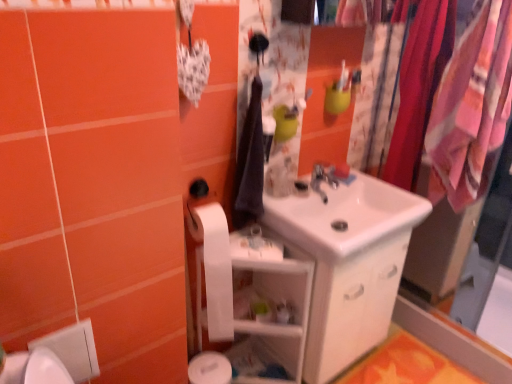
Question: From the image's perspective, is orange fabric bath mat at lower right on top of white glossy sink at center?

Choices:
 (A) no
 (B) yes

Answer: (A)

Question: Considering the relative positions of orange fabric bath mat at lower right and white glossy sink at center in the image provided, is orange fabric bath mat at lower right to the right of white glossy sink at center from the viewer's perspective?

Choices:
 (A) yes
 (B) no

Answer: (A)

Question: Is orange fabric bath mat at lower right touching white glossy sink at center?

Choices:
 (A) no
 (B) yes

Answer: (A)

Question: Could you tell me if orange fabric bath mat at lower right is turned towards white glossy sink at center?

Choices:
 (A) yes
 (B) no

Answer: (B)

Question: Is orange fabric bath mat at lower right turned away from white glossy sink at center?

Choices:
 (A) yes
 (B) no

Answer: (B)

Question: Which is correct: white glossy shelf at center is inside silky pink fabric at right, the first clothesline viewed from the left, or outside of it?

Choices:
 (A) outside
 (B) inside

Answer: (A)

Question: From a real-world perspective, relative to silky pink fabric at right, the first clothesline viewed from the left, is white glossy shelf at center vertically above or below?

Choices:
 (A) below
 (B) above

Answer: (A)

Question: From the image's perspective, relative to silky pink fabric at right, which ranks as the second clothesline in right-to-left order, is white glossy shelf at center above or below?

Choices:
 (A) below
 (B) above

Answer: (A)

Question: Visually, is white glossy shelf at center positioned to the left or to the right of silky pink fabric at right, which ranks as the second clothesline in right-to-left order?

Choices:
 (A) left
 (B) right

Answer: (A)

Question: Would you say silky pink fabric at right, the first clothesline viewed from the left, is inside or outside white glossy sink at center?

Choices:
 (A) outside
 (B) inside

Answer: (A)

Question: In terms of size, does silky pink fabric at right, which ranks as the second clothesline in right-to-left order, appear bigger or smaller than white glossy sink at center?

Choices:
 (A) big
 (B) small

Answer: (B)

Question: Is silky pink fabric at right, the first clothesline viewed from the left, taller or shorter than white glossy sink at center?

Choices:
 (A) tall
 (B) short

Answer: (A)

Question: Looking at their shapes, would you say silky pink fabric at right, which ranks as the second clothesline in right-to-left order, is wider or thinner than white glossy sink at center?

Choices:
 (A) thin
 (B) wide

Answer: (A)

Question: In terms of size, does white glossy sink at center appear bigger or smaller than dark blue fabric at center?

Choices:
 (A) big
 (B) small

Answer: (A)

Question: Relative to dark blue fabric at center, is white glossy sink at center in front or behind?

Choices:
 (A) behind
 (B) front

Answer: (A)